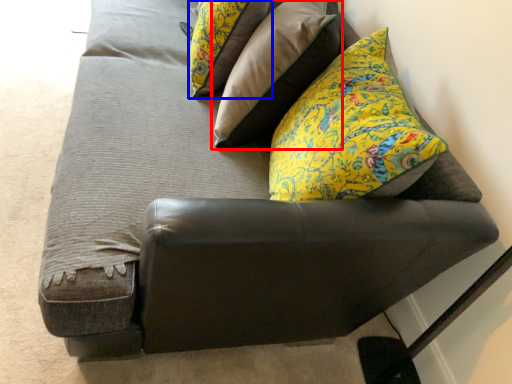
Question: Among these objects, which one is farthest to the camera, pillow (highlighted by a red box) or pillow (highlighted by a blue box)?

Choices:
 (A) pillow
 (B) pillow

Answer: (B)